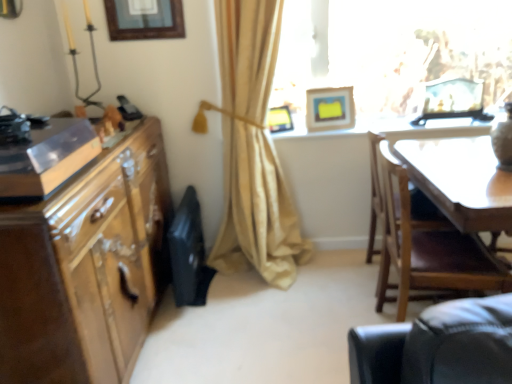
What is the approximate height of shiny brown cabinet at left?

shiny brown cabinet at left is 3.36 feet in height.

In order to face shiny brown cabinet at left, should I rotate leftwards or rightwards?

To align with it, rotate left about 20.759°.

Measure the distance between point [336,133] and camera.

Point [336,133] and camera are 8.46 feet apart from each other.

This screenshot has width=512, height=384. Describe the element at coordinates (422, 243) in the screenshot. I see `wooden chair at right` at that location.

What do you see at coordinates (390, 51) in the screenshot?
I see `translucent glass frame at upper right` at bounding box center [390, 51].

Locate an element on the screen. This screenshot has height=384, width=512. wooden picture frame at upper center, acting as the fourth picture frame starting from the right is located at coordinates (144, 19).

From a real-world perspective, is beige fabric curtain at center physically below wooden picture frame at upper right, positioned as the fourth picture frame in left-to-right order?

Correct, in the physical world, beige fabric curtain at center is lower than wooden picture frame at upper right, positioned as the fourth picture frame in left-to-right order.

How distant is beige fabric curtain at center from wooden picture frame at upper right, the 1th picture frame viewed from the right?

beige fabric curtain at center and wooden picture frame at upper right, the 1th picture frame viewed from the right, are 3.57 feet apart.

Is beige fabric curtain at center facing towards wooden picture frame at upper right, the 1th picture frame viewed from the right?

No, beige fabric curtain at center is not oriented towards wooden picture frame at upper right, the 1th picture frame viewed from the right.

Which is more to the left, beige fabric curtain at center or wooden picture frame at upper right, positioned as the fourth picture frame in left-to-right order?

beige fabric curtain at center.

Which picture frame is the 4th one when counting from the back of the metallic silver desk at left? Please provide its 2D coordinates.

[(279, 119)]

Is point (270, 110) farther from camera compared to point (82, 135)?

Yes.

From a real-world perspective, who is located lower, matte yellow picture frame at upper center, which is the 3th picture frame from right to left, or metallic silver desk at left?

In real-world perspective, matte yellow picture frame at upper center, which is the 3th picture frame from right to left, is lower.

Is matte yellow picture frame at upper center, the 2th picture frame when ordered from left to right, situated inside metallic silver desk at left or outside?

matte yellow picture frame at upper center, the 2th picture frame when ordered from left to right, is not inside metallic silver desk at left, it's outside.

Based on the photo, is metallic silver desk at left directly adjacent to beige fabric curtain at center?

No, metallic silver desk at left is not beside beige fabric curtain at center.

Where is `curtain behind the metallic silver desk at left`? curtain behind the metallic silver desk at left is located at coordinates (253, 149).

Considering the positions of objects metallic silver desk at left and beige fabric curtain at center in the image provided, who is more to the left, metallic silver desk at left or beige fabric curtain at center?

metallic silver desk at left.

Between wooden picture frame at upper center, the first picture frame when ordered from left to right, and wooden picture frame at upper right, positioned as the fourth picture frame in left-to-right order, which one has larger size?

Bigger between the two is wooden picture frame at upper right, positioned as the fourth picture frame in left-to-right order.

Considering the relative sizes of wooden picture frame at upper center, acting as the fourth picture frame starting from the right, and wooden picture frame at upper right, the 1th picture frame viewed from the right, in the image provided, is wooden picture frame at upper center, acting as the fourth picture frame starting from the right, thinner than wooden picture frame at upper right, the 1th picture frame viewed from the right,?

Correct, the width of wooden picture frame at upper center, acting as the fourth picture frame starting from the right, is less than that of wooden picture frame at upper right, the 1th picture frame viewed from the right.

Relative to wooden picture frame at upper right, the 1th picture frame viewed from the right, is wooden picture frame at upper center, acting as the fourth picture frame starting from the right, in front or behind?

wooden picture frame at upper center, acting as the fourth picture frame starting from the right, is in front of wooden picture frame at upper right, the 1th picture frame viewed from the right.

From a real-world perspective, is wooden picture frame at upper center, the first picture frame when ordered from left to right, physically above wooden picture frame at upper right, positioned as the fourth picture frame in left-to-right order?

Correct, in the physical world, wooden picture frame at upper center, the first picture frame when ordered from left to right, is higher than wooden picture frame at upper right, positioned as the fourth picture frame in left-to-right order.

Considering the sizes of objects matte yellow picture frame at upper center, the 2th picture frame when ordered from left to right, and matte yellow picture frame at upper right, positioned as the 3th picture frame in left-to-right order, in the image provided, who is shorter, matte yellow picture frame at upper center, the 2th picture frame when ordered from left to right, or matte yellow picture frame at upper right, positioned as the 3th picture frame in left-to-right order,?

Standing shorter between the two is matte yellow picture frame at upper center, the 2th picture frame when ordered from left to right.

Considering the relative sizes of matte yellow picture frame at upper center, the 2th picture frame when ordered from left to right, and matte yellow picture frame at upper right, which is the 2th picture frame in right-to-left order, in the image provided, is matte yellow picture frame at upper center, the 2th picture frame when ordered from left to right, thinner than matte yellow picture frame at upper right, which is the 2th picture frame in right-to-left order,?

Incorrect, the width of matte yellow picture frame at upper center, the 2th picture frame when ordered from left to right, is not less than that of matte yellow picture frame at upper right, which is the 2th picture frame in right-to-left order.

In the scene shown: From a real-world perspective, does matte yellow picture frame at upper center, the 2th picture frame when ordered from left to right, sit lower than matte yellow picture frame at upper right, positioned as the 3th picture frame in left-to-right order?

Indeed, from a real-world perspective, matte yellow picture frame at upper center, the 2th picture frame when ordered from left to right, is positioned beneath matte yellow picture frame at upper right, positioned as the 3th picture frame in left-to-right order.

Can you confirm if white glossy table at upper center is smaller than wooden picture frame at upper right, positioned as the fourth picture frame in left-to-right order?

Actually, white glossy table at upper center might be larger than wooden picture frame at upper right, positioned as the fourth picture frame in left-to-right order.

In the scene shown: Is white glossy table at upper center facing away from wooden picture frame at upper right, the 1th picture frame viewed from the right?

No, wooden picture frame at upper right, the 1th picture frame viewed from the right, is not at the back of white glossy table at upper center.

Is point (405, 129) farther from viewer compared to point (444, 88)?

No, it is not.

In terms of width, does white glossy table at upper center look wider or thinner when compared to wooden picture frame at upper right, positioned as the fourth picture frame in left-to-right order?

In the image, white glossy table at upper center appears to be wider than wooden picture frame at upper right, positioned as the fourth picture frame in left-to-right order.

Is wooden picture frame at upper right, the 1th picture frame viewed from the right, aimed at white glossy table at upper center?

No.

I want to click on counter top below the wooden picture frame at upper right, the 1th picture frame viewed from the right (from a real-world perspective), so click(x=377, y=126).

Is wooden picture frame at upper right, positioned as the fourth picture frame in left-to-right order, with white glossy table at upper center?

No.

From a real-world perspective, is wooden picture frame at upper right, the 1th picture frame viewed from the right, physically below white glossy table at upper center?

Incorrect, from a real-world perspective, wooden picture frame at upper right, the 1th picture frame viewed from the right, is higher than white glossy table at upper center.

The height and width of the screenshot is (384, 512). I want to click on curtain in front of the wooden picture frame at upper right, the 1th picture frame viewed from the right, so click(253, 149).

This screenshot has width=512, height=384. Find the location of `the 3rd picture frame directly beneath the metallic silver desk at left (from a real-world perspective)`. the 3rd picture frame directly beneath the metallic silver desk at left (from a real-world perspective) is located at coordinates (279, 119).

From the image, which object appears to be farther from beige fabric curtain at center, wooden picture frame at upper right, positioned as the fourth picture frame in left-to-right order, or wooden picture frame at upper center, acting as the fourth picture frame starting from the right?

wooden picture frame at upper right, positioned as the fourth picture frame in left-to-right order.

Looking at the image, which one is located closer to beige fabric curtain at center, metallic silver desk at left or wooden chair at right?

The object closer to beige fabric curtain at center is wooden chair at right.

Based on their spatial positions, is matte yellow picture frame at upper center, which is the 3th picture frame from right to left, or white glossy table at upper center further from wooden chair at right?

matte yellow picture frame at upper center, which is the 3th picture frame from right to left, lies further to wooden chair at right than the other object.

When comparing their distances from beige fabric curtain at center, does wooden picture frame at upper center, the first picture frame when ordered from left to right, or matte yellow picture frame at upper center, the 2th picture frame when ordered from left to right, seem closer?

matte yellow picture frame at upper center, the 2th picture frame when ordered from left to right, is closer to beige fabric curtain at center.

From the image, which object appears to be nearer to shiny brown cabinet at left, beige fabric curtain at center or wooden chair at right?

beige fabric curtain at center.

When comparing their distances from matte yellow picture frame at upper center, which is the 3th picture frame from right to left, does white glossy table at upper center or beige fabric curtain at center seem further?

Based on the image, beige fabric curtain at center appears to be further to matte yellow picture frame at upper center, which is the 3th picture frame from right to left.

Based on their spatial positions, is translucent glass frame at upper right or white glossy table at upper center further from wooden picture frame at upper right, positioned as the fourth picture frame in left-to-right order?

The object further to wooden picture frame at upper right, positioned as the fourth picture frame in left-to-right order, is translucent glass frame at upper right.

Estimate the real-world distances between objects in this image. Which object is further from wooden picture frame at upper right, positioned as the fourth picture frame in left-to-right order, beige fabric curtain at center or shiny brown cabinet at left?

shiny brown cabinet at left is further to wooden picture frame at upper right, positioned as the fourth picture frame in left-to-right order.

Identify the location of chair located between wooden picture frame at upper center, the first picture frame when ordered from left to right, and translucent glass frame at upper right in the left-right direction. (422, 243).

In order to click on counter top located between metallic silver desk at left and wooden picture frame at upper right, the 1th picture frame viewed from the right, in the left-right direction in this screenshot , I will do `click(377, 126)`.

Locate an element on the screen. Image resolution: width=512 pixels, height=384 pixels. picture frame situated between matte yellow picture frame at upper center, the 2th picture frame when ordered from left to right, and white glossy table at upper center from left to right is located at coordinates [330, 109].

Where is `desk located between shiny brown cabinet at left and matte yellow picture frame at upper right, positioned as the 3th picture frame in left-to-right order, in the depth direction`? This screenshot has height=384, width=512. desk located between shiny brown cabinet at left and matte yellow picture frame at upper right, positioned as the 3th picture frame in left-to-right order, in the depth direction is located at coordinates (46, 158).